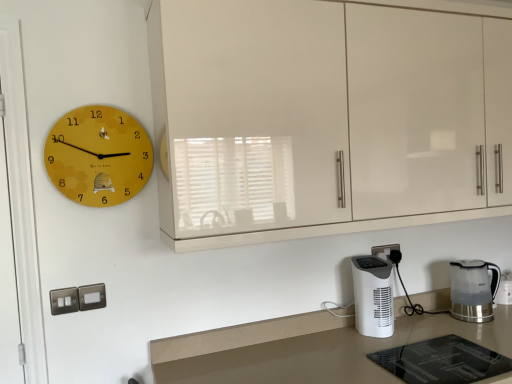
Question: From the image's perspective, is glossy cream cabinetry at upper center above or below white glossy countertop at lower center?

Choices:
 (A) below
 (B) above

Answer: (B)

Question: Considering their positions, is glossy cream cabinetry at upper center located in front of or behind white glossy countertop at lower center?

Choices:
 (A) behind
 (B) front

Answer: (A)

Question: Which object is positioned closest to the white plastic heater at lower right, the second home appliance viewed from the right?

Choices:
 (A) yellow matte clock at upper left
 (B) white glossy countertop at lower center
 (C) transparent glass door at left
 (D) white plastic electric outlet at lower right
 (E) glossy cream cabinetry at upper center

Answer: (D)

Question: Which object is positioned closest to the transparent glass door at left?

Choices:
 (A) glossy cream cabinetry at upper center
 (B) white glossy countertop at lower center
 (C) yellow matte clock at upper left
 (D) white plastic heater at lower right, which is the 1th home appliance in left-to-right order
 (E) transparent plastic kettle at lower right, acting as the first home appliance starting from the right

Answer: (C)